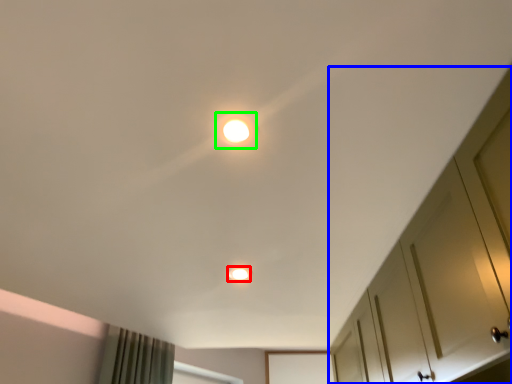
Question: Estimate the real-world distances between objects in this image. Which object is closer to dot (highlighted by a red box), dresser (highlighted by a blue box) or dot (highlighted by a green box)?

Choices:
 (A) dresser
 (B) dot

Answer: (A)